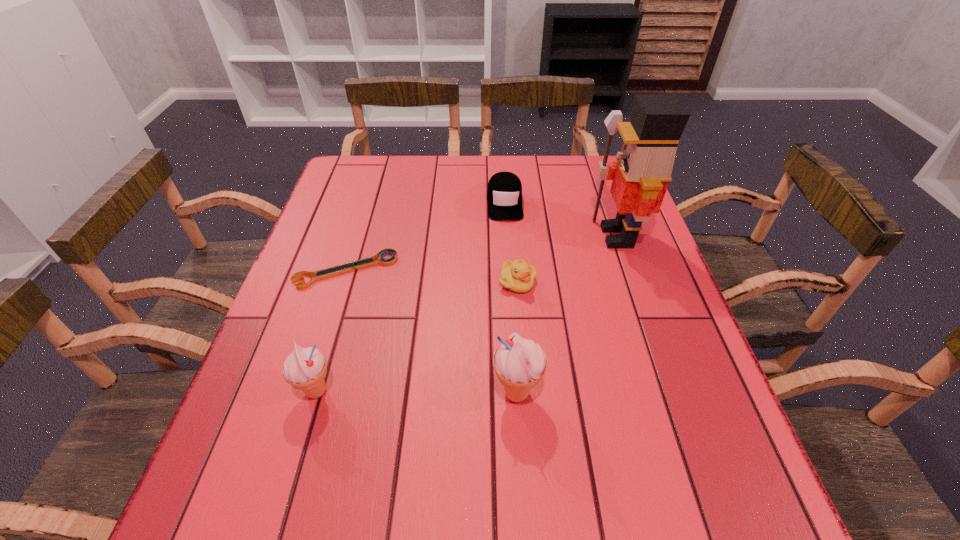
Find the location of a particular element. This screenshot has height=540, width=960. the shorter icecream is located at coordinates (305, 369).

This screenshot has width=960, height=540. Find the location of `the fourth shortest object`. the fourth shortest object is located at coordinates (305, 369).

Where is `the fifth shortest object`? the fifth shortest object is located at coordinates (519, 364).

In order to click on the right icecream in this screenshot , I will do `click(519, 364)`.

Locate an element on the screen. The image size is (960, 540). cap is located at coordinates pyautogui.click(x=504, y=193).

Identify the location of the shortest object. (351, 266).

Image resolution: width=960 pixels, height=540 pixels. I want to click on duckling, so click(517, 276).

You are a GUI agent. You are given a task and a screenshot of the screen. Output one action in this format:
    pyautogui.click(x=<x>, y=<y>)
    Task: Click on the tallest object
    
    Given the screenshot: What is the action you would take?
    pyautogui.click(x=641, y=175)

Where is `the rightmost object`? the rightmost object is located at coordinates (641, 175).

Where is `vacant space located on the right of the left icecream`? Image resolution: width=960 pixels, height=540 pixels. vacant space located on the right of the left icecream is located at coordinates (378, 392).